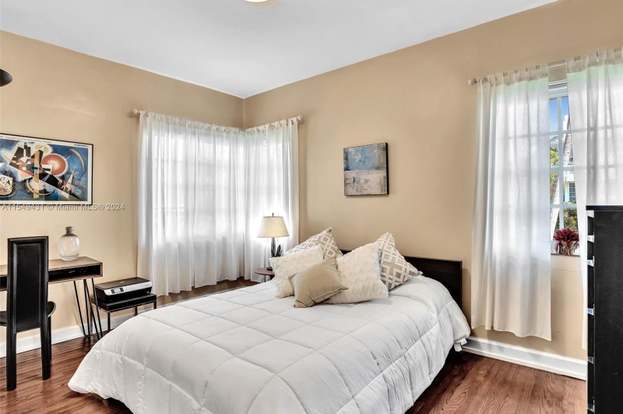
You are a GUI agent. You are given a task and a screenshot of the screen. Output one action in this format:
    pyautogui.click(x=<x>, y=<y>)
    Task: Click on the pillow
    This screenshot has width=623, height=414.
    Given the screenshot: What is the action you would take?
    pyautogui.click(x=315, y=272), pyautogui.click(x=372, y=276), pyautogui.click(x=394, y=258), pyautogui.click(x=288, y=257), pyautogui.click(x=315, y=237)